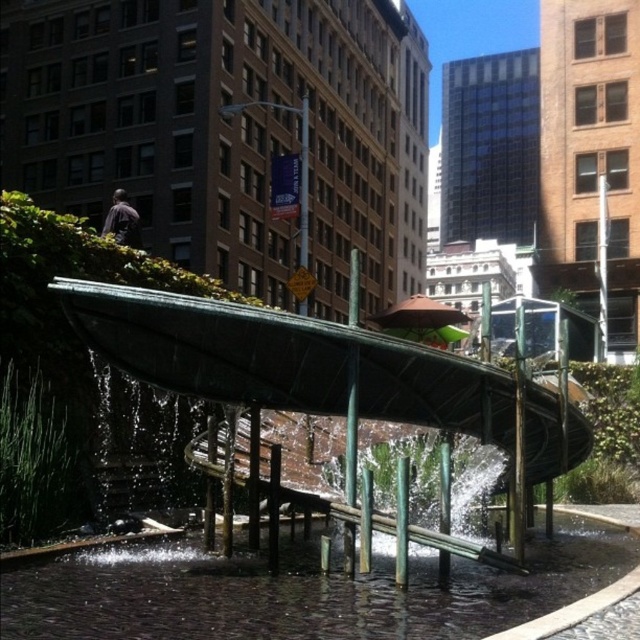
Based on the photo, is clear water at center below green metallic water feature at center?

Correct, clear water at center is located below green metallic water feature at center.

What do you see at coordinates (300, 595) in the screenshot? I see `clear water at center` at bounding box center [300, 595].

Identify the location of clear water at center. (300, 595).